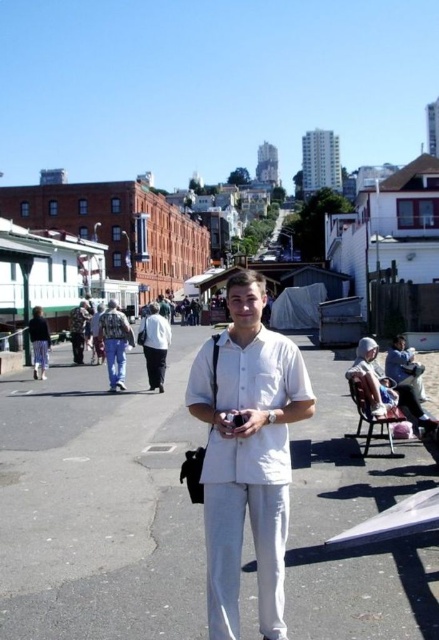
You are a pedestrian standing on the matte black pants at lower left. You want to walk to the white asphalt at center. Which direction should you move to reach it?

The white asphalt at center is positioned on the right side of matte black pants at lower left, so you should move to your right to reach it.

You are a delivery person trying to find the best path to deliver a package quickly. You see the white asphalt at center and the matte black pants at lower left. Which surface should you choose to move faster?

The white asphalt at center is bigger than matte black pants at lower left, so you should choose the white asphalt at center to move faster because it provides a larger and more stable surface for delivery.

You are a fashion designer observing a person in a white matte shirt at center and white cotton pants at center. You want to create a matching accessory that complements both items. Considering their spatial relationship, what could be a suitable accessory?

The white matte shirt at center and white cotton pants at center are 81.58 feet apart, which indicates they belong to separate individuals. A suitable accessory would be a white belt for the person wearing the white cotton pants at center and a white necklace for the person wearing the white matte shirt at center to maintain the monochromatic theme.